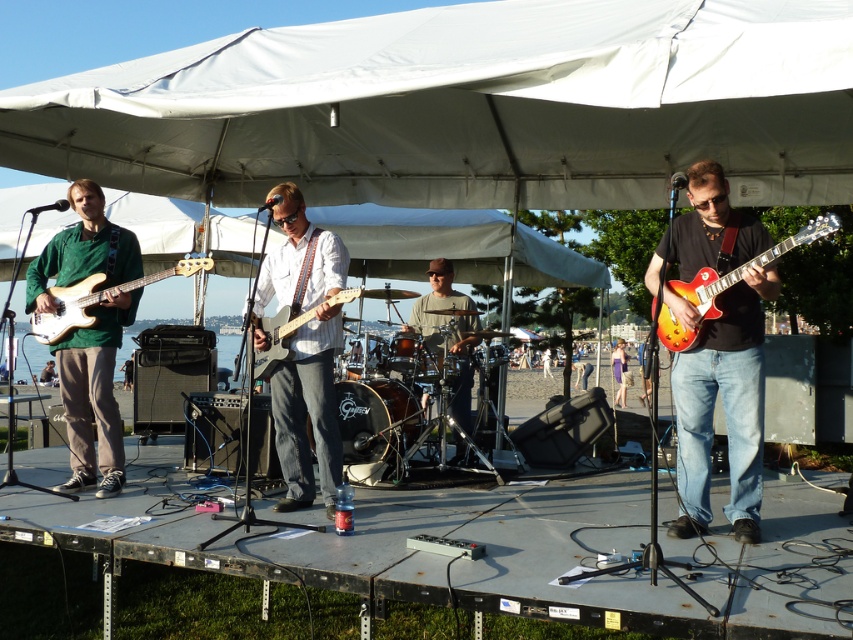
In the scene shown: You are standing at the front of the stage and want to grab the matte black guitar at right to adjust its position. Considering the distance, can you reach it without moving from your current spot?

The matte black guitar at right is 14.33 feet away from the viewer, so you cannot reach it without moving closer.

You are a stagehand carrying a 12 meter long extension cord. You need to connect the sunburst wood electric guitar at right to the purple satin dress at center. Can you cover the distance with the extension cord?

The distance between the sunburst wood electric guitar at right and the purple satin dress at center is 13.46 meters. The extension cord is only 12 meters long, so it is not long enough to reach.